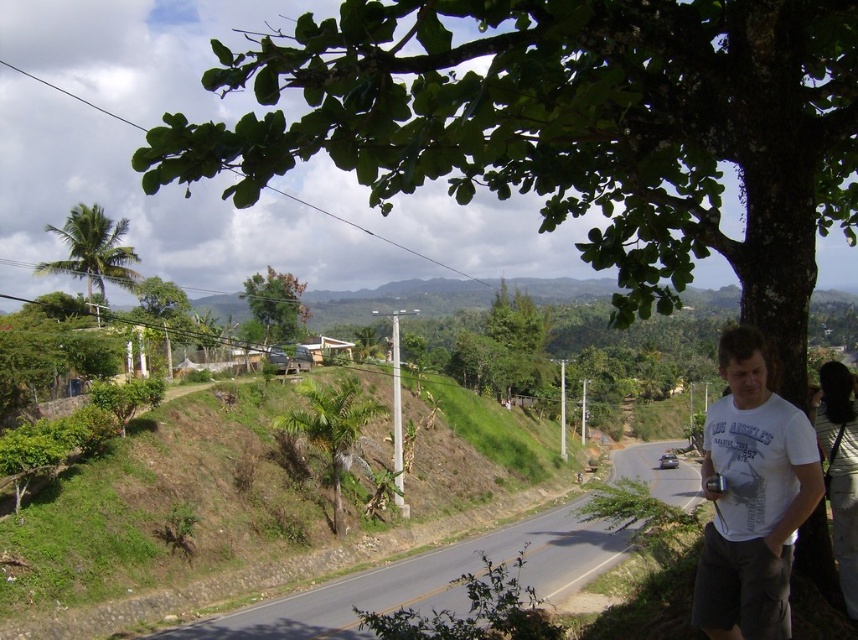
You are standing at the point with coordinates point (80, 209) in the scene. You want to walk towards the point with coordinates point (349, 387). Which direction should you move relative to your current position?

Since point (349, 387) is in front of point (80, 209), you should move forward in the direction of point 0.606, 0.608 from your current position at point (80, 209).